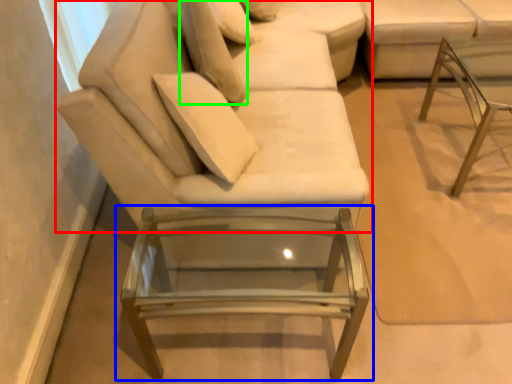
Question: Which object is the farthest from studio couch (highlighted by a red box)? Choose among these: table (highlighted by a blue box) or pillow (highlighted by a green box).

Choices:
 (A) table
 (B) pillow

Answer: (A)